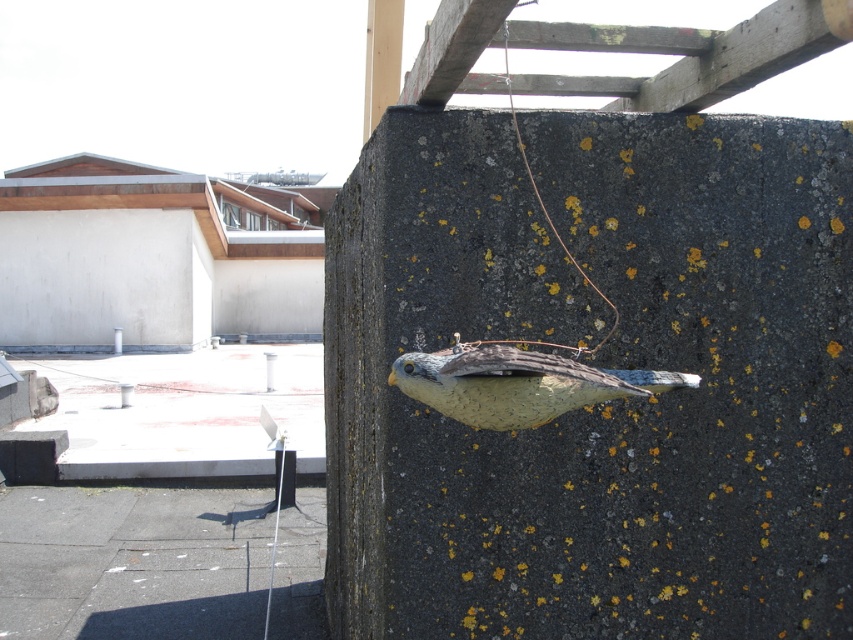
Is speckled concrete bird at center behind speckled clay bird at center?

Yes, it is behind speckled clay bird at center.

Between point (351, 528) and point (624, 388), which one is positioned in front?

Point (624, 388) is in front.

Between point (752, 179) and point (553, 371), which one is positioned in front?

Point (553, 371) is in front.

The height and width of the screenshot is (640, 853). I want to click on speckled concrete bird at center, so click(x=599, y=365).